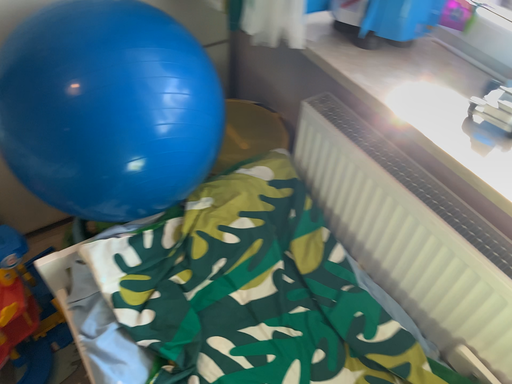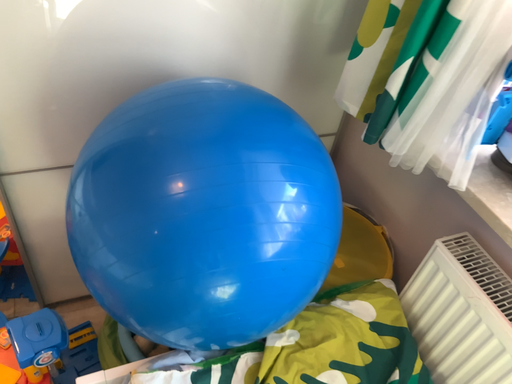
Question: How did the camera likely rotate when shooting the video?

Choices:
 (A) rotated downward
 (B) rotated upward

Answer: (B)